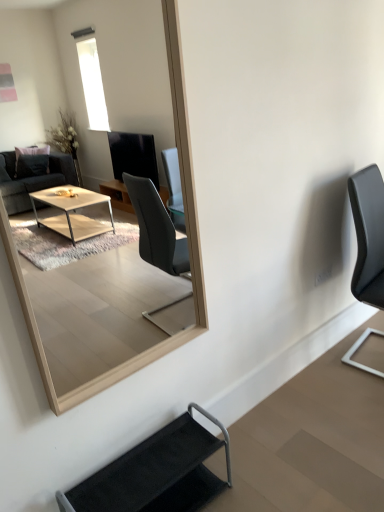
Identify the location of vacant space underneath black leather chair at right, acting as the first chair starting from the top (from a real-world perspective). The image size is (384, 512). (366, 355).